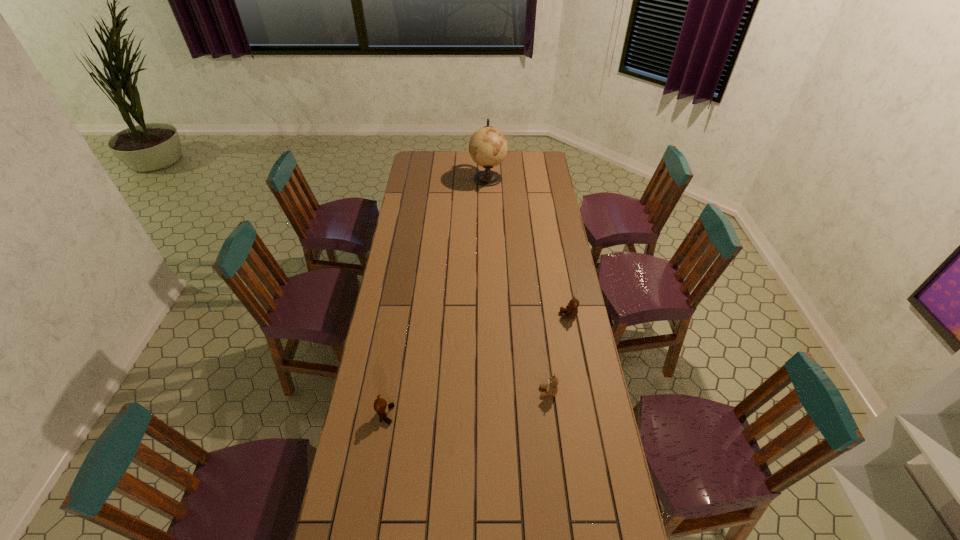
Locate an element on the screen. The width and height of the screenshot is (960, 540). vacant space situated on the front-facing side of the third object from right to left is located at coordinates (447, 178).

This screenshot has width=960, height=540. Find the location of `vacant space located 0.280m on the face of the rightmost teddy bear`. vacant space located 0.280m on the face of the rightmost teddy bear is located at coordinates (493, 315).

Image resolution: width=960 pixels, height=540 pixels. Identify the location of vacant space located on the face of the rightmost teddy bear. [474, 315].

Where is `vacant space located 0.330m on the face of the rightmost teddy bear`? This screenshot has width=960, height=540. vacant space located 0.330m on the face of the rightmost teddy bear is located at coordinates (482, 315).

Locate an element on the screen. The image size is (960, 540). free space located 0.210m on the front-facing side of the leftmost teddy bear is located at coordinates (454, 415).

Identify the location of vacant space situated on the front-facing side of the second nearest teddy bear. This screenshot has height=540, width=960. (468, 392).

Image resolution: width=960 pixels, height=540 pixels. What are the coordinates of `vacant space located 0.050m on the front-facing side of the second nearest teddy bear` in the screenshot? It's located at (526, 392).

I want to click on vacant space located 0.250m on the front-facing side of the second nearest teddy bear, so click(x=470, y=392).

In order to click on object that is at the far edge in this screenshot , I will do `click(488, 147)`.

At what (x,y) coordinates should I click in order to perform the action: click on object present at the left edge. Please return your answer as a coordinate pair (x, y). Image resolution: width=960 pixels, height=540 pixels. Looking at the image, I should click on pyautogui.click(x=381, y=407).